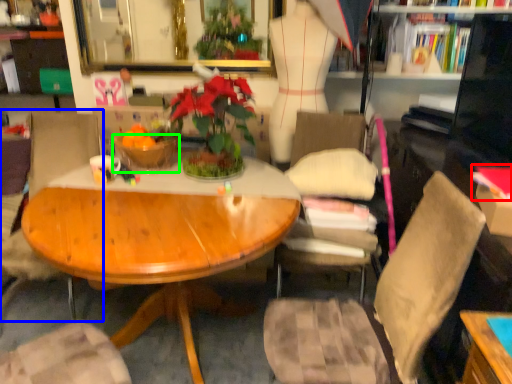
Question: Which object is the farthest from book (highlighted by a red box)? Choose among these: chair (highlighted by a blue box) or bowl (highlighted by a green box).

Choices:
 (A) chair
 (B) bowl

Answer: (A)